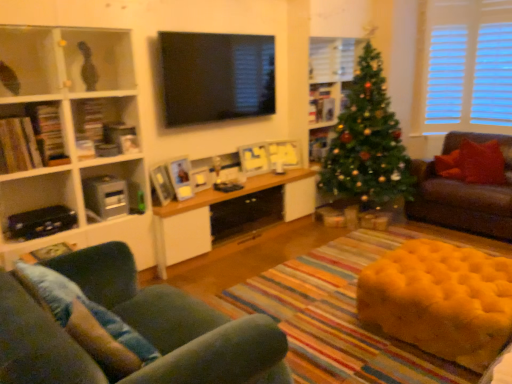
Describe the element at coordinates (324, 102) in the screenshot. I see `wooden picture frame at upper center, arranged as the second shelf when viewed from the right` at that location.

Image resolution: width=512 pixels, height=384 pixels. Describe the element at coordinates (113, 190) in the screenshot. I see `metallic gray cabinet at left, marked as the third shelf in a right-to-left arrangement` at that location.

What do you see at coordinates (461, 204) in the screenshot? I see `brown leather couch at right, arranged as the first studio couch when viewed from the right` at bounding box center [461, 204].

The image size is (512, 384). What do you see at coordinates (88, 322) in the screenshot? I see `denim cushion at lower left, the first pillow ordered from the bottom` at bounding box center [88, 322].

Image resolution: width=512 pixels, height=384 pixels. What do you see at coordinates (320, 142) in the screenshot?
I see `wooden picture frame at center, marked as the 1th shelf in a right-to-left arrangement` at bounding box center [320, 142].

This screenshot has height=384, width=512. I want to click on matte white bookshelf at left, marked as the fourth shelf in a right-to-left arrangement, so click(x=75, y=137).

Is wooden bookshelf at left, the 5th shelf viewed from the right, located within matte white bookshelf at left, marked as the 2th shelf in a left-to-right arrangement?

Indeed, wooden bookshelf at left, the 5th shelf viewed from the right, is located within matte white bookshelf at left, marked as the 2th shelf in a left-to-right arrangement.

Is matte white bookshelf at left, marked as the 2th shelf in a left-to-right arrangement, bigger or smaller than wooden bookshelf at left, which ranks as the first shelf in left-to-right order?

matte white bookshelf at left, marked as the 2th shelf in a left-to-right arrangement, is bigger than wooden bookshelf at left, which ranks as the first shelf in left-to-right order.

How many degrees apart are the facing directions of matte white bookshelf at left, marked as the 2th shelf in a left-to-right arrangement, and wooden bookshelf at left, the 5th shelf viewed from the right?

There is a 0.472-degree angle between the facing directions of matte white bookshelf at left, marked as the 2th shelf in a left-to-right arrangement, and wooden bookshelf at left, the 5th shelf viewed from the right.

From a real-world perspective, is matte white bookshelf at left, marked as the fourth shelf in a right-to-left arrangement, physically above wooden bookshelf at left, positioned as the 2th shelf in front-to-back order?

Actually, matte white bookshelf at left, marked as the fourth shelf in a right-to-left arrangement, is physically below wooden bookshelf at left, positioned as the 2th shelf in front-to-back order, in the real world.

From the image's perspective, is matte white bookshelf at left, which appears as the 5th shelf when viewed from the back, above black glossy tv at upper center?

No, from the image's perspective, matte white bookshelf at left, which appears as the 5th shelf when viewed from the back, is not on top of black glossy tv at upper center.

Which point is more distant from viewer, (51, 184) or (163, 102)?

The point (163, 102) is behind.

Between matte white bookshelf at left, which is the first shelf from front to back, and black glossy tv at upper center, which one has smaller width?

With smaller width is black glossy tv at upper center.

Is black glossy tv at upper center inside matte white bookshelf at left, marked as the fourth shelf in a right-to-left arrangement?

Actually, black glossy tv at upper center is outside matte white bookshelf at left, marked as the fourth shelf in a right-to-left arrangement.

From the image's perspective, between wooden cabinet at center and wooden bookshelf at left, which ranks as the first shelf in left-to-right order, who is located below?

From the image's view, wooden cabinet at center is below.

Is wooden cabinet at center completely or partially outside of wooden bookshelf at left, which ranks as the first shelf in left-to-right order?

That's correct, wooden cabinet at center is outside of wooden bookshelf at left, which ranks as the first shelf in left-to-right order.

Who is bigger, wooden cabinet at center or wooden bookshelf at left, the 5th shelf viewed from the right?

Bigger between the two is wooden cabinet at center.

Find the location of a particular element. the 2nd shelf in front of the wooden cabinet at center, starting your count from the anchor is located at coordinates (32, 139).

Considering the sizes of objects green textured christmas tree at center and velvet green sofa at lower left, the 1th studio couch ordered from the bottom, in the image provided, who is shorter, green textured christmas tree at center or velvet green sofa at lower left, the 1th studio couch ordered from the bottom,?

velvet green sofa at lower left, the 1th studio couch ordered from the bottom, is shorter.

From the image's perspective, between green textured christmas tree at center and velvet green sofa at lower left, acting as the second studio couch starting from the top, which one is located above?

green textured christmas tree at center appears higher in the image.

Can you confirm if green textured christmas tree at center is positioned to the right of velvet green sofa at lower left, the second studio couch in the right-to-left sequence?

Yes, green textured christmas tree at center is to the right of velvet green sofa at lower left, the second studio couch in the right-to-left sequence.

From a real-world perspective, is green textured christmas tree at center above or below velvet green sofa at lower left, acting as the second studio couch starting from the top?

In terms of real-world spatial position, green textured christmas tree at center is above velvet green sofa at lower left, acting as the second studio couch starting from the top.

Considering the sizes of objects matte white bookshelf at left, which appears as the 5th shelf when viewed from the back, and wooden cabinet at center in the image provided, who is bigger, matte white bookshelf at left, which appears as the 5th shelf when viewed from the back, or wooden cabinet at center?

Bigger between the two is matte white bookshelf at left, which appears as the 5th shelf when viewed from the back.

Is matte white bookshelf at left, marked as the fourth shelf in a right-to-left arrangement, behind wooden cabinet at center?

No, the depth of matte white bookshelf at left, marked as the fourth shelf in a right-to-left arrangement, is less than that of wooden cabinet at center.

Is matte white bookshelf at left, marked as the fourth shelf in a right-to-left arrangement, surrounding wooden cabinet at center?

No, wooden cabinet at center is not inside matte white bookshelf at left, marked as the fourth shelf in a right-to-left arrangement.

From a real-world perspective, does matte white bookshelf at left, which appears as the 5th shelf when viewed from the back, stand above wooden cabinet at center?

Correct, in the physical world, matte white bookshelf at left, which appears as the 5th shelf when viewed from the back, is higher than wooden cabinet at center.

Which is more to the left, wooden bookshelf at left, placed as the fourth shelf when sorted from back to front, or wooden picture frame at center, which ranks as the second shelf in back-to-front order?

Positioned to the left is wooden bookshelf at left, placed as the fourth shelf when sorted from back to front.

From the wooden picture frame at center, which appears as the 5th shelf when viewed from the left, count the 4th shelf to the left and point to it. Please provide its 2D coordinates.

[(32, 139)]

Can we say wooden bookshelf at left, which ranks as the first shelf in left-to-right order, lies outside wooden picture frame at center, which appears as the 5th shelf when viewed from the left?

Absolutely, wooden bookshelf at left, which ranks as the first shelf in left-to-right order, is external to wooden picture frame at center, which appears as the 5th shelf when viewed from the left.

From the image's perspective, between wooden bookshelf at left, the 5th shelf viewed from the right, and wooden picture frame at center, marked as the 1th shelf in a right-to-left arrangement, who is located below?

wooden bookshelf at left, the 5th shelf viewed from the right, appears lower in the image.

Between wooden picture frame at center, marked as the 1th shelf in a right-to-left arrangement, and metallic gray cabinet at left, which appears as the 3th shelf when viewed from the left, which one appears on the right side from the viewer's perspective?

From the viewer's perspective, wooden picture frame at center, marked as the 1th shelf in a right-to-left arrangement, appears more on the right side.

Is metallic gray cabinet at left, which appears as the 3th shelf when viewed from the left, located within wooden picture frame at center, which appears as the 5th shelf when viewed from the left?

Actually, metallic gray cabinet at left, which appears as the 3th shelf when viewed from the left, is outside wooden picture frame at center, which appears as the 5th shelf when viewed from the left.

Does wooden picture frame at center, arranged as the fourth shelf when viewed from the front, touch metallic gray cabinet at left, marked as the 3th shelf in a back-to-front arrangement?

A: No, wooden picture frame at center, arranged as the fourth shelf when viewed from the front, is not in contact with metallic gray cabinet at left, marked as the 3th shelf in a back-to-front arrangement.

Find the location of a particular element. The width and height of the screenshot is (512, 384). the 1st shelf directly above the matte white bookshelf at left, which appears as the 5th shelf when viewed from the back (from a real-world perspective) is located at coordinates (32, 139).

Locate an element on the screen. This screenshot has height=384, width=512. shelf that is the 2nd one when counting leftward from the black glossy tv at upper center is located at coordinates (75, 137).

Estimate the real-world distances between objects in this image. Which object is further from wooden cabinet at center, metallic gray cabinet at left, the third shelf from the front, or black glossy tv at upper center?

The object further to wooden cabinet at center is black glossy tv at upper center.

Based on the photo, based on their spatial positions, is green textured christmas tree at center or velvet green sofa at lower left, the 1th studio couch ordered from the bottom, closer to yellow tufted ottoman at lower right?

velvet green sofa at lower left, the 1th studio couch ordered from the bottom, is closer to yellow tufted ottoman at lower right.

Looking at the image, which one is located further to brown leather couch at right, acting as the second studio couch starting from the left, metallic gray cabinet at left, which appears as the 3th shelf when viewed from the left, or wooden picture frame at upper center, marked as the 4th shelf in a left-to-right arrangement?

metallic gray cabinet at left, which appears as the 3th shelf when viewed from the left.

Estimate the real-world distances between objects in this image. Which object is further from wooden bookshelf at left, the 5th shelf viewed from the right, denim cushion at lower left, acting as the first pillow starting from the front, or red velvet pillow at right, acting as the first pillow starting from the back?

red velvet pillow at right, acting as the first pillow starting from the back, is further to wooden bookshelf at left, the 5th shelf viewed from the right.

From the image, which object appears to be farther from denim cushion at lower left, which is counted as the first pillow, starting from the left, green textured christmas tree at center or metallic gray cabinet at left, marked as the third shelf in a right-to-left arrangement?

green textured christmas tree at center is positioned further to the anchor denim cushion at lower left, which is counted as the first pillow, starting from the left.

Considering their positions, is brown leather couch at right, positioned as the 2th studio couch in bottom-to-top order, positioned closer to denim cushion at lower left, acting as the first pillow starting from the front, than velvet green sofa at lower left, the second studio couch in the right-to-left sequence?

velvet green sofa at lower left, the second studio couch in the right-to-left sequence.

Considering their positions, is denim cushion at lower left, which is counted as the first pillow, starting from the left, positioned further to matte white bookshelf at left, which is the first shelf from front to back, than wooden cabinet at center?

denim cushion at lower left, which is counted as the first pillow, starting from the left, is further to matte white bookshelf at left, which is the first shelf from front to back.

Considering their positions, is brown leather couch at right, the second studio couch when ordered from front to back, positioned further to wooden picture frame at upper center, arranged as the 5th shelf when viewed from the front, than wooden picture frame at center, which ranks as the second shelf in back-to-front order?

brown leather couch at right, the second studio couch when ordered from front to back, is further to wooden picture frame at upper center, arranged as the 5th shelf when viewed from the front.

Identify the location of table located between velvet green sofa at lower left, the first studio couch when ordered from left to right, and wooden picture frame at upper center, arranged as the second shelf when viewed from the right, in the depth direction. This screenshot has height=384, width=512. (214, 203).

Find the location of a particular element. christmas tree between wooden picture frame at upper center, marked as the 4th shelf in a left-to-right arrangement, and brown leather couch at right, positioned as the 2th studio couch in bottom-to-top order is located at coordinates (367, 144).

Locate an element on the screen. window screen between wooden cabinet at center and wooden picture frame at upper center, marked as the 4th shelf in a left-to-right arrangement, in the front-back direction is located at coordinates (216, 77).

Locate an element on the screen. The width and height of the screenshot is (512, 384). pillow between wooden cabinet at center and brown leather couch at right, the second studio couch when ordered from front to back is located at coordinates (481, 163).